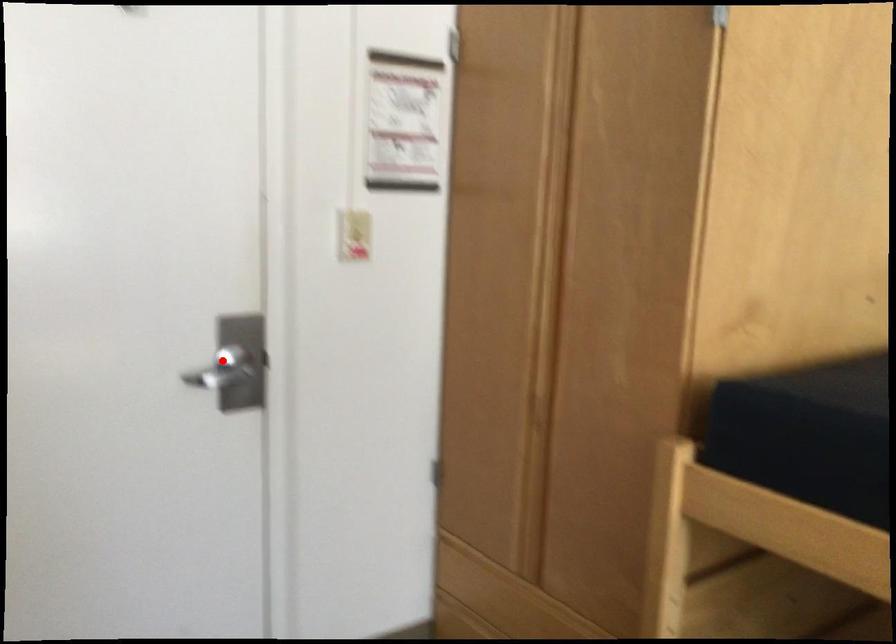
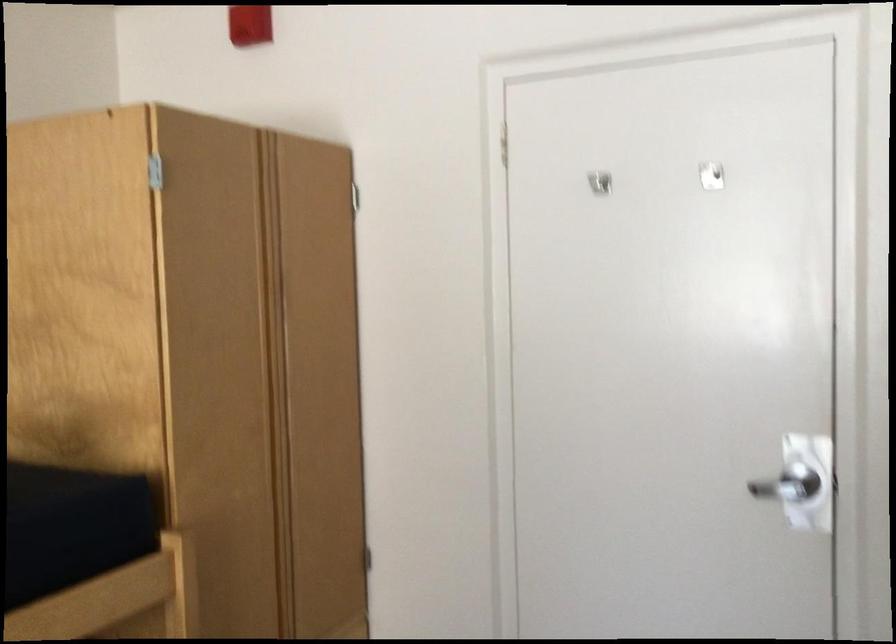
Find the pixel in the second image that matches the highlighted location in the first image.

(788, 484)